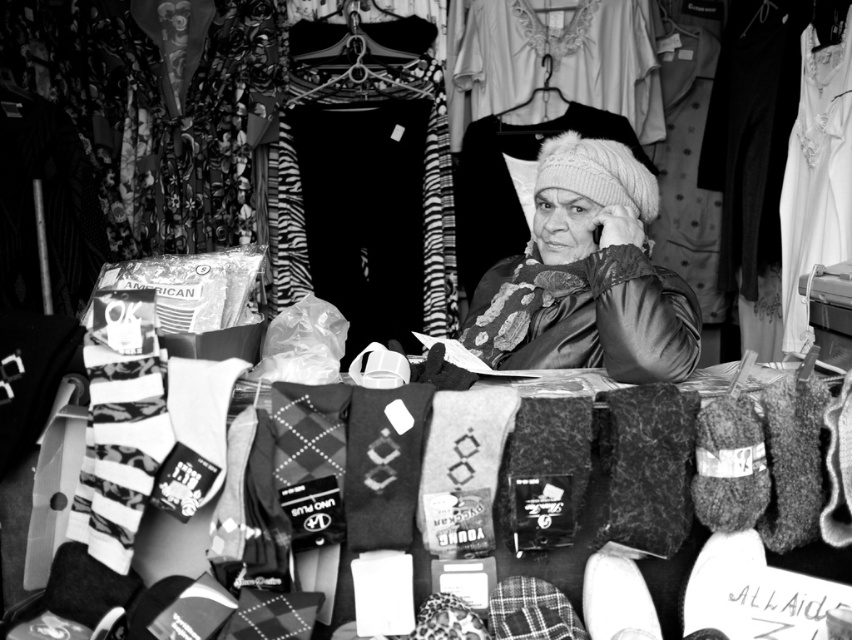
Question: Which object is farther from the camera taking this photo?

Choices:
 (A) velvet-like black jacket at center
 (B) fluffy knit hat at center

Answer: (B)

Question: Does white lace blouse at upper center have a greater width compared to fluffy knit hat at center?

Choices:
 (A) no
 (B) yes

Answer: (B)

Question: Does white lace blouse at upper center appear on the right side of fluffy knit hat at center?

Choices:
 (A) yes
 (B) no

Answer: (A)

Question: Is velvet-like black jacket at center smaller than fluffy knit hat at center?

Choices:
 (A) no
 (B) yes

Answer: (A)

Question: Which point is farther to the camera?

Choices:
 (A) velvet-like black jacket at center
 (B) white lace blouse at upper center
 (C) fluffy knit hat at center

Answer: (C)

Question: Which of the following is the farthest from the observer?

Choices:
 (A) (517, 211)
 (B) (684, 356)

Answer: (A)